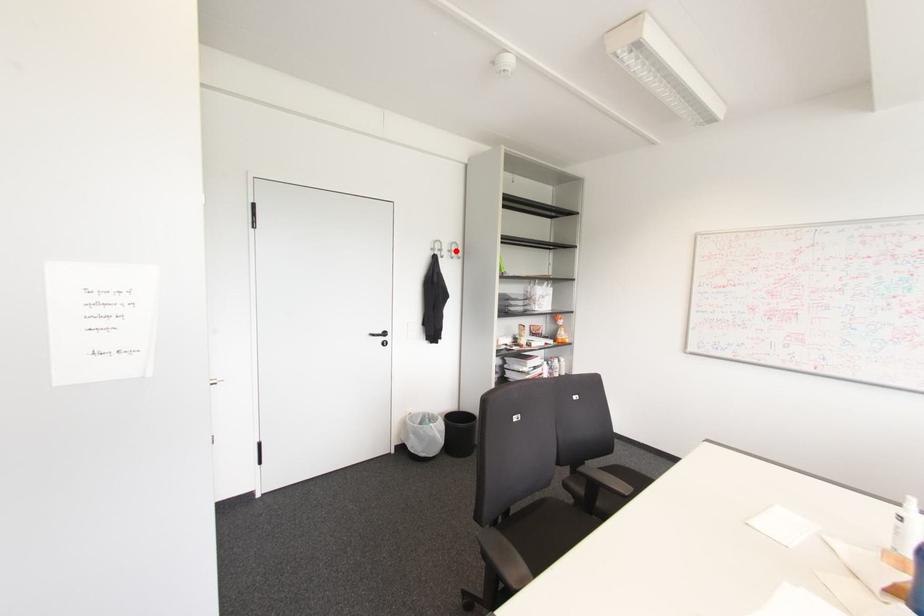
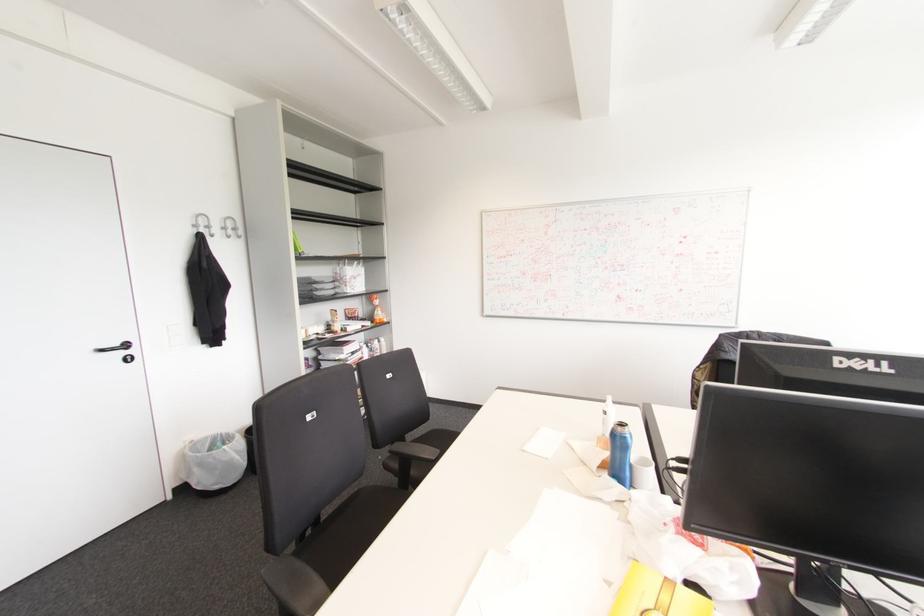
Locate, in the second image, the point that corresponds to the highlighted location in the first image.

(234, 229)